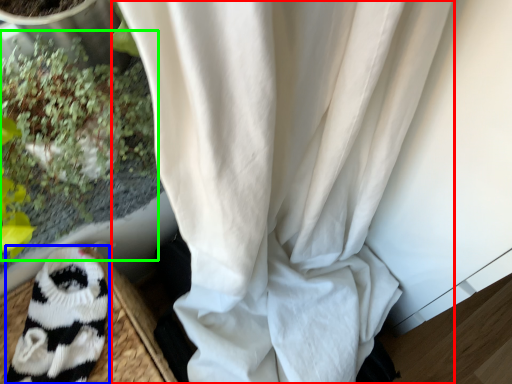
Question: Which is farther away from curtain (highlighted by a red box)? animal (highlighted by a blue box) or floral arrangement (highlighted by a green box)?

Choices:
 (A) animal
 (B) floral arrangement

Answer: (A)